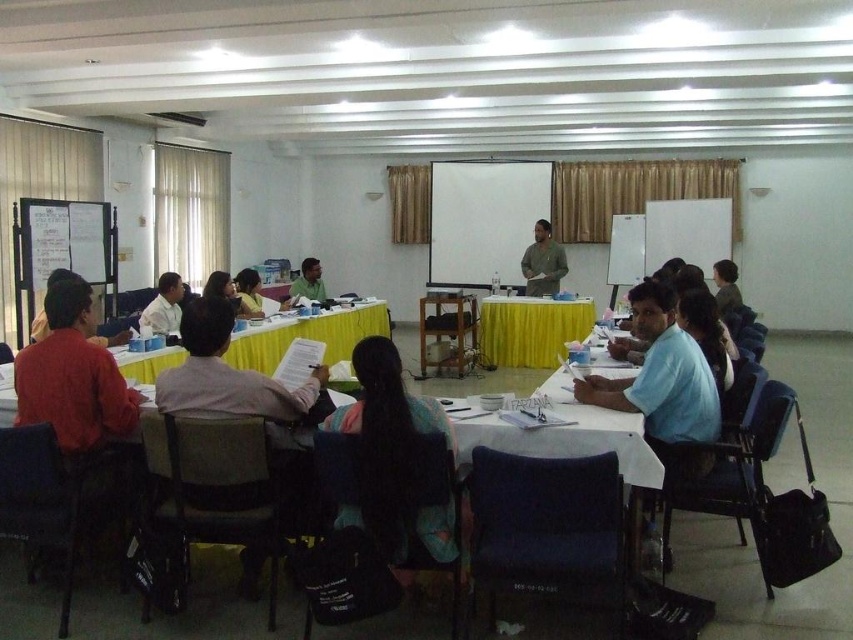
You are a participant in the meeting and need to move from your current position near the dark gray fabric chair at lower left to the white matte projection screen at center to adjust it. Considering the room layout, is the distance between them manageable for you to walk comfortably without needing to detour around any obstacles?

The distance between the dark gray fabric chair at lower left and the white matte projection screen at center is 7.55 meters. Since there are no mentioned obstacles in the room layout, you can walk straight to the screen comfortably.

You are an attendee in the meeting room described. You need to locate the matte white shirt at left and the light brown hair at center. From your perspective, which one is positioned to the right?

The light brown hair at center is positioned to the right of the matte white shirt at left.